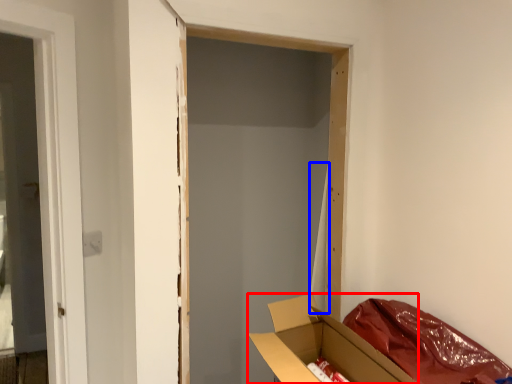
Question: Which point is further to the camera, box (highlighted by a red box) or curtain (highlighted by a blue box)?

Choices:
 (A) box
 (B) curtain

Answer: (B)